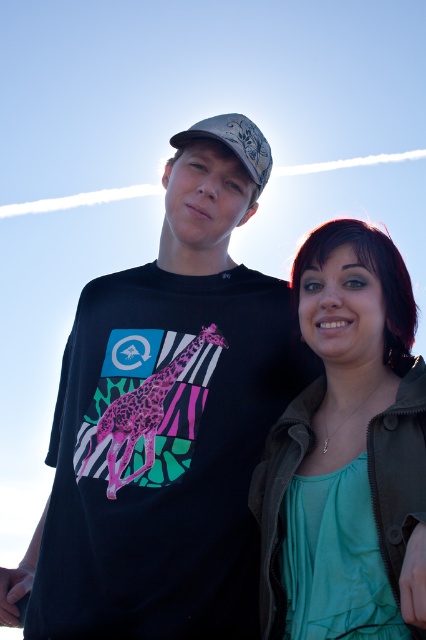
You are a photographer trying to capture a clear shot of the pink leopard print giraffe at center and the white textured baseball cap at center. Which object should you focus on first to ensure both are in focus?

The pink leopard print giraffe at center is closer to the viewer than the white textured baseball cap at center, so focus on the pink leopard print giraffe at center first. This will ensure the closer object is in focus, and the background object may still be sharp due to depth of field.